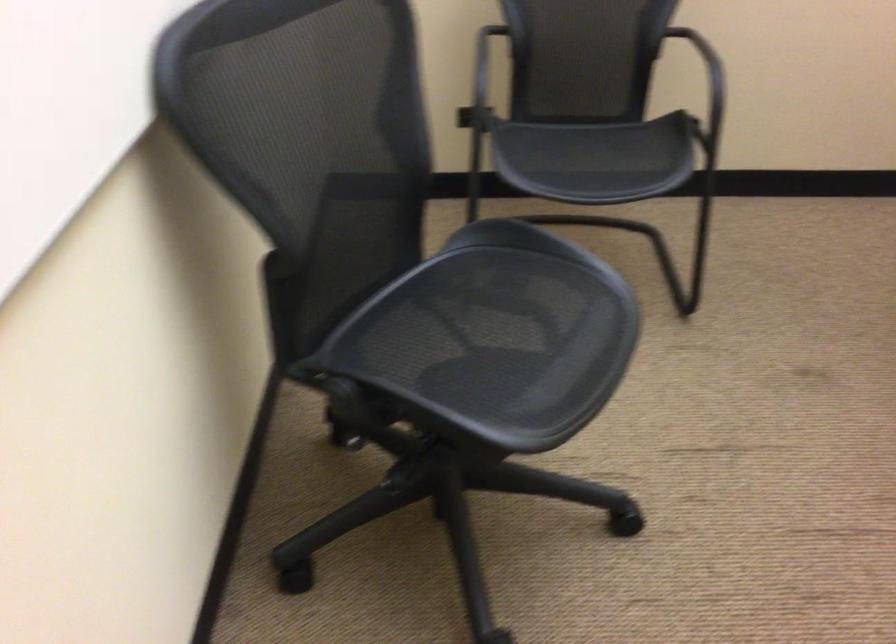
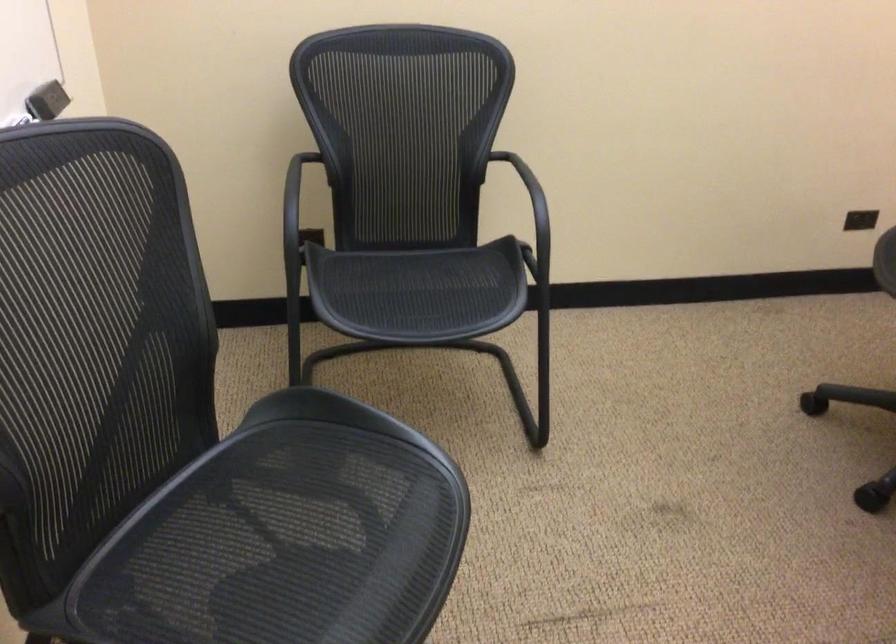
Find the pixel in the second image that matches point (582, 147) in the first image.

(409, 287)